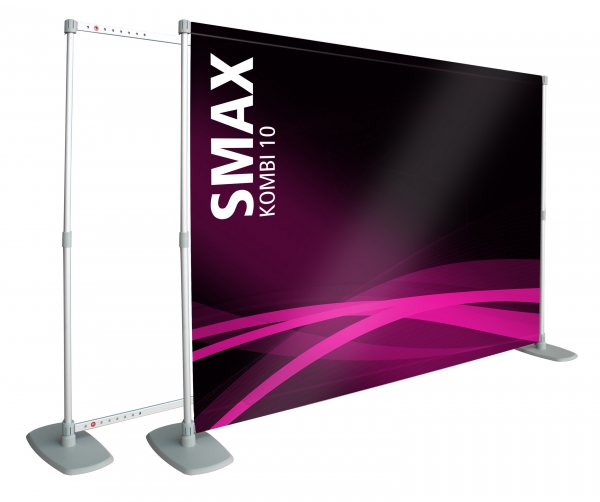
At what (x,y) coordinates should I click in order to perform the action: click on screen. Please return your answer as a coordinate pair (x, y). The image size is (600, 502). Looking at the image, I should click on (405, 170).